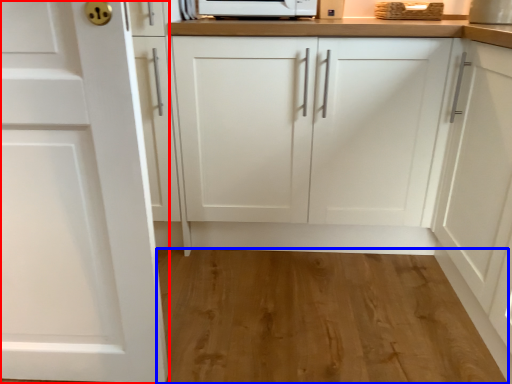
Question: Among these objects, which one is farthest to the camera, cabinetry (highlighted by a red box) or hardwood (highlighted by a blue box)?

Choices:
 (A) cabinetry
 (B) hardwood

Answer: (B)